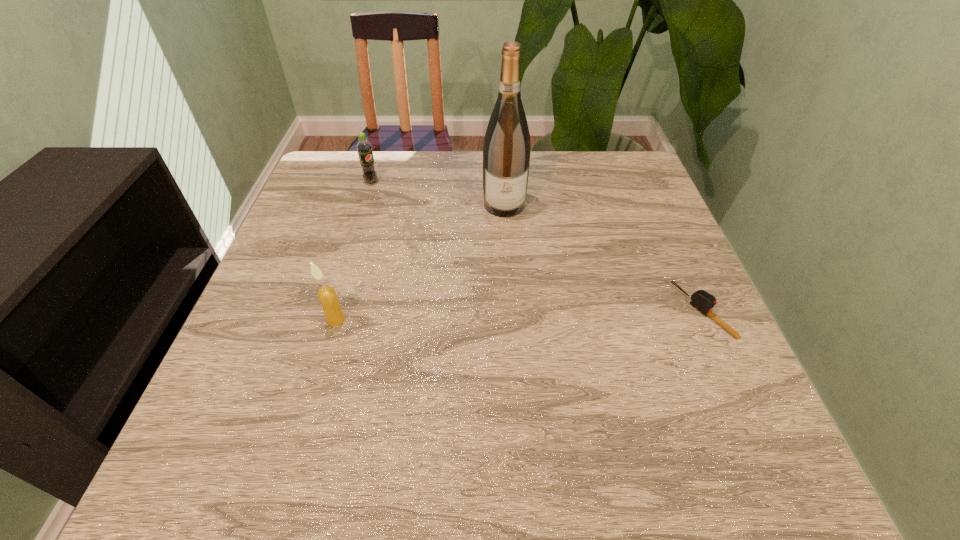
Identify the location of vacant area in the image that satisfies the following two spatial constraints: 1. on the front side of the tallest object; 2. on the right side of the shortest object. (511, 311).

Image resolution: width=960 pixels, height=540 pixels. I want to click on vacant area in the image that satisfies the following two spatial constraints: 1. on the back side of the candle; 2. on the left side of the shortest object, so click(x=339, y=311).

Identify the location of vacant area that satisfies the following two spatial constraints: 1. on the front side of the tallest object; 2. on the right side of the rightmost object. This screenshot has width=960, height=540. (511, 311).

I want to click on free space that satisfies the following two spatial constraints: 1. on the front side of the shortest object; 2. on the right side of the second farthest object, so click(511, 311).